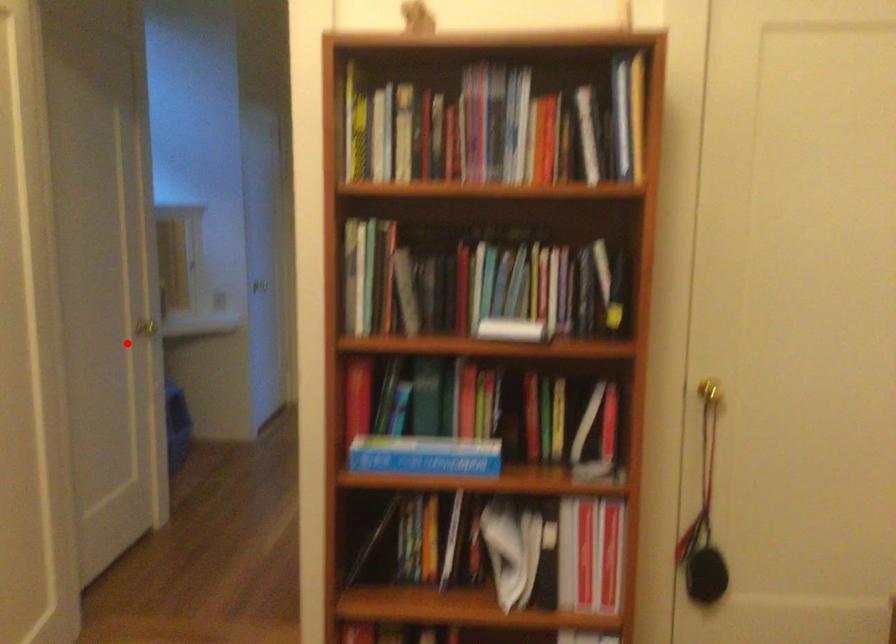
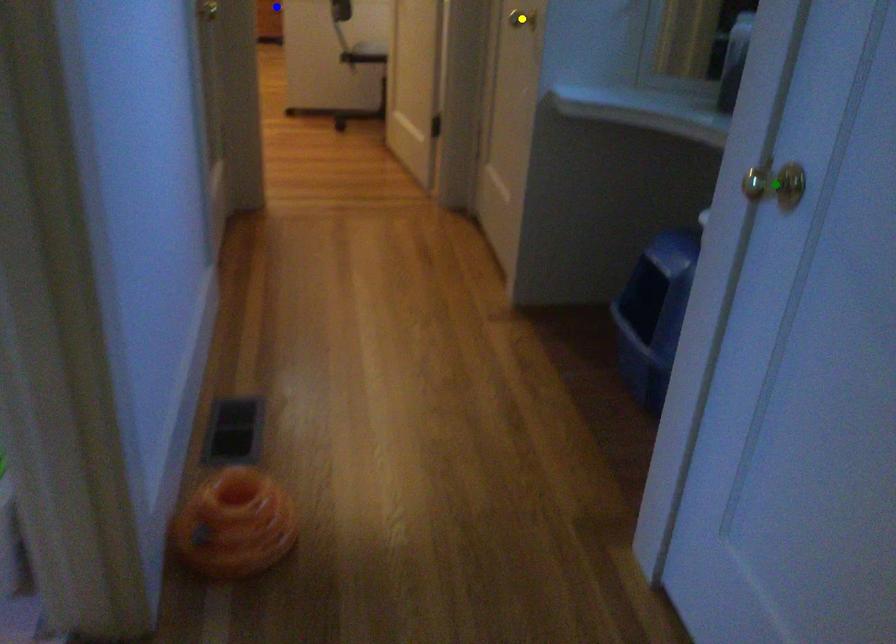
Question: I am providing you with two images of the same scene from different viewpoints. A red point is marked on the first image. You are given multiple points on the second image. Which mark in image 2 goes with the point in image 1?

Choices:
 (A) yellow point
 (B) blue point
 (C) green point

Answer: (A)